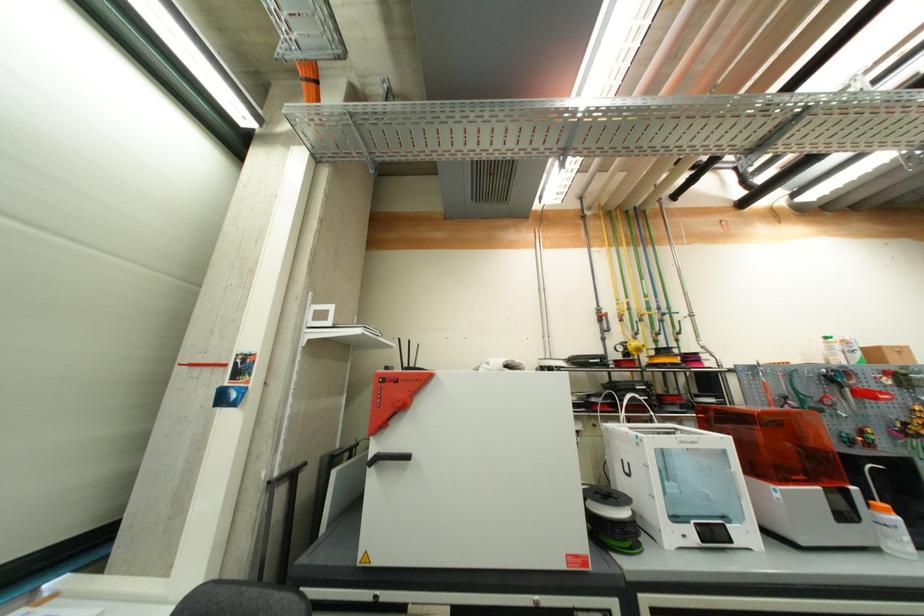
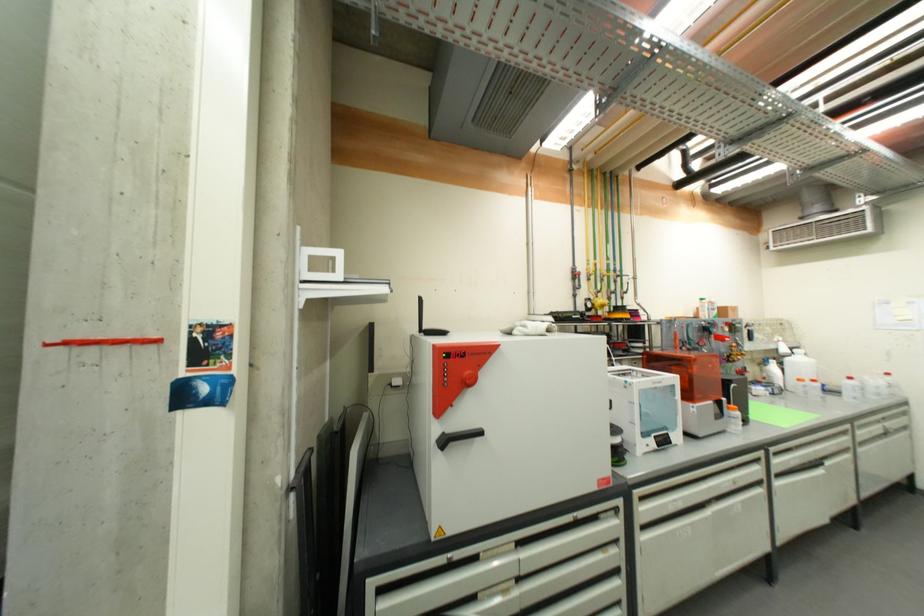
Where in the second image is the point corresponding to point (891, 513) from the first image?

(739, 411)